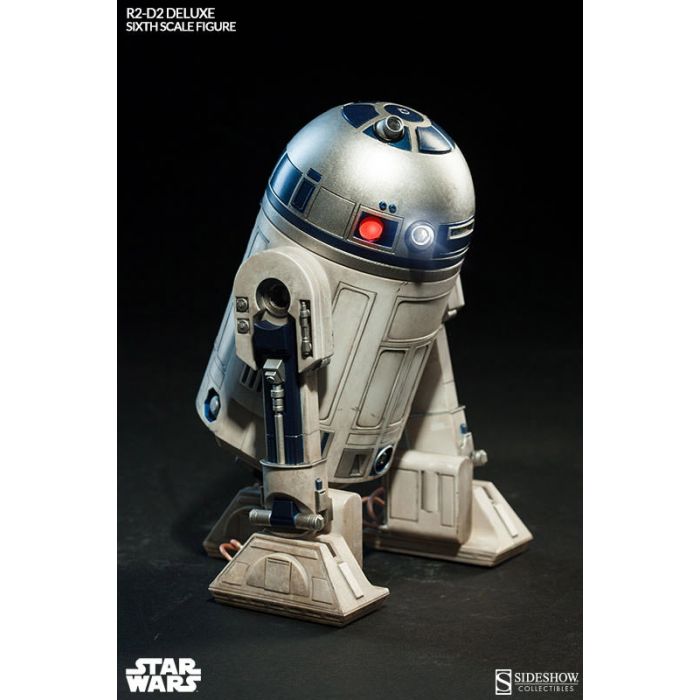
Locate an element on the screen. The width and height of the screenshot is (700, 700). light is located at coordinates (348, 227), (424, 232).